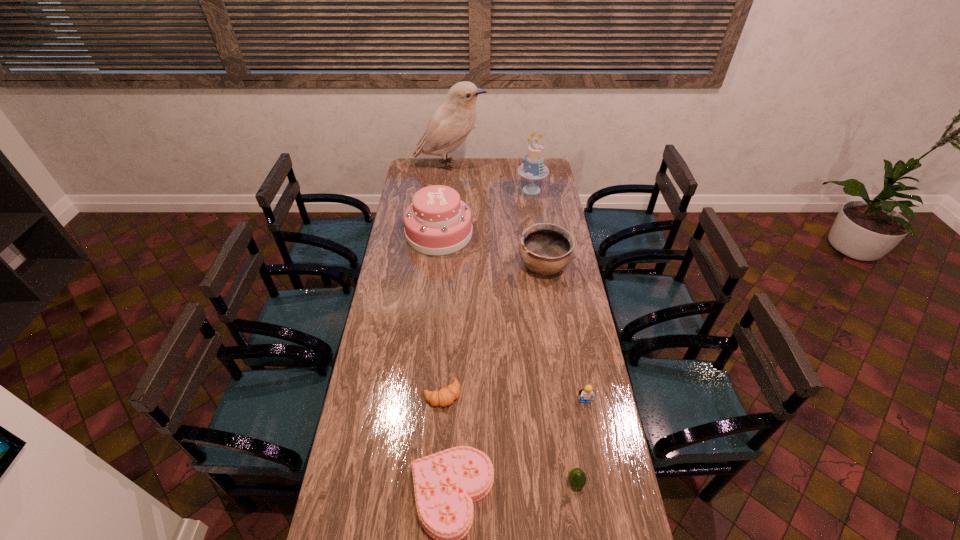
Image resolution: width=960 pixels, height=540 pixels. Identify the location of the farthest object. click(x=450, y=124).

This screenshot has width=960, height=540. Find the location of `parakeet`. parakeet is located at coordinates (450, 124).

Where is `the second farthest object`? The width and height of the screenshot is (960, 540). the second farthest object is located at coordinates (533, 168).

I want to click on the rightmost cake, so click(533, 168).

This screenshot has width=960, height=540. Find the location of `the second farthest cake`. the second farthest cake is located at coordinates (437, 222).

You are a GUI agent. You are given a task and a screenshot of the screen. Output one action in this format:
    pyautogui.click(x=<x>, y=<y>)
    Task: Click on the second tallest cake
    This screenshot has height=540, width=960.
    Given the screenshot: What is the action you would take?
    pyautogui.click(x=437, y=222)

What are the coordinates of `the fourth tallest object` in the screenshot? It's located at (545, 249).

Find the location of a particular element. Lego is located at coordinates (587, 393).

Where is `avocado`? This screenshot has width=960, height=540. avocado is located at coordinates (577, 478).

Where is `crescent roll`? The width and height of the screenshot is (960, 540). crescent roll is located at coordinates (445, 396).